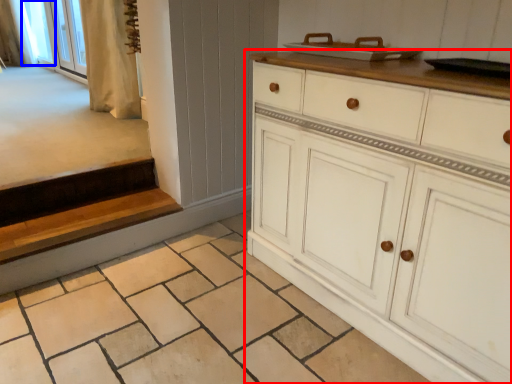
Question: Which of the following is the farthest to the observer, chest of drawers (highlighted by a red box) or window screen (highlighted by a blue box)?

Choices:
 (A) chest of drawers
 (B) window screen

Answer: (B)